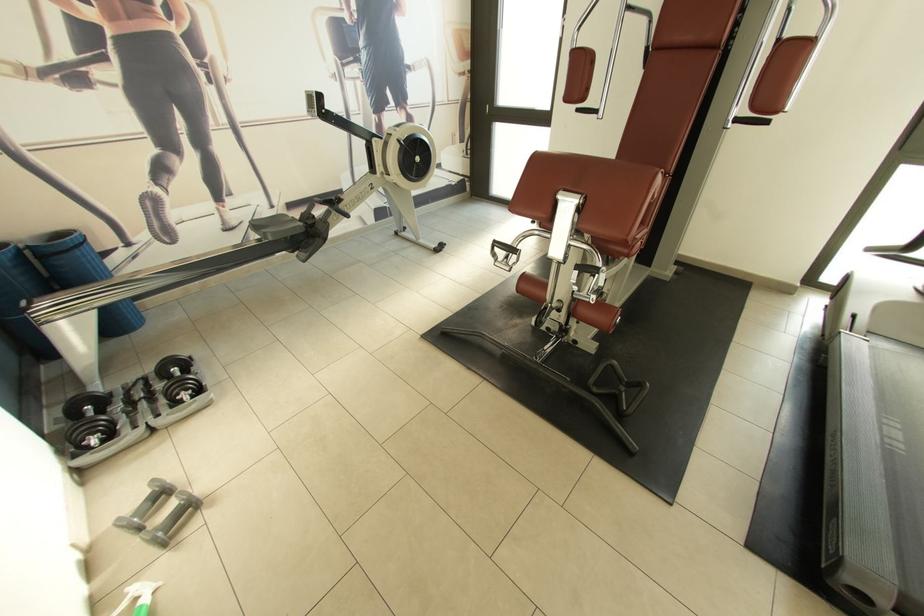
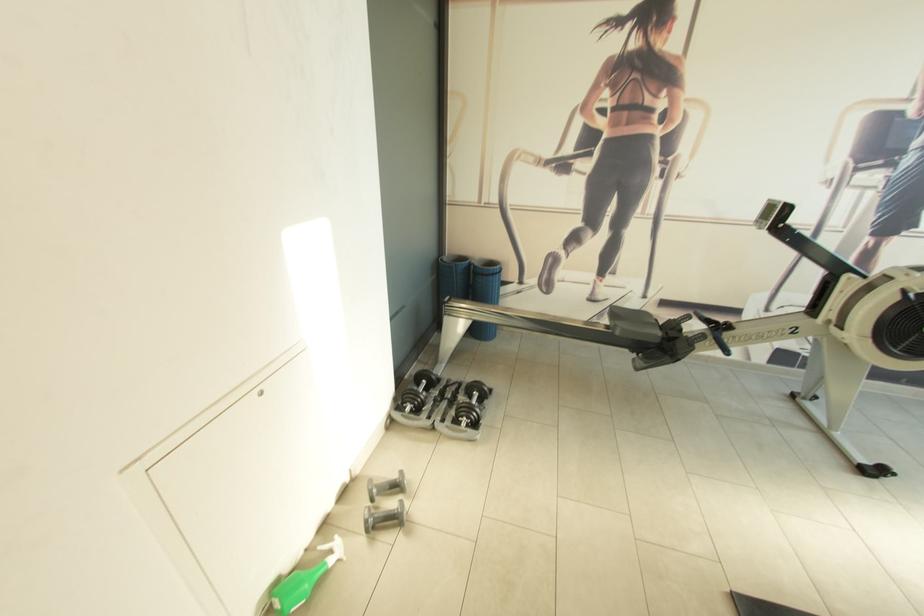
The point at [196,519] is marked in the first image. Where is the corresponding point in the second image?

(397, 528)